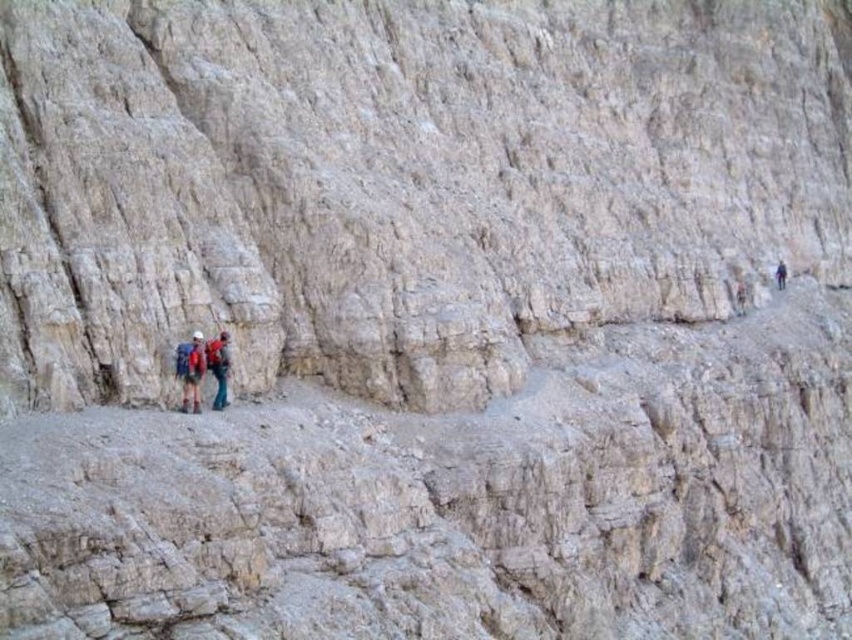
You are a hiker planning to move from the red fabric backpack at center to the dark blue fabric backpack at right. Given that the path between them is 56.47 meters, can you safely traverse this distance if your maximum safe distance for a single traverse is 50 meters?

The distance between the red fabric backpack at center and the dark blue fabric backpack at right is 56.47 meters, which exceeds your maximum safe distance of 50 meters. Therefore, it is not safe to traverse this distance in one go.

You are a hiker planning to take a photo of both the matte red backpacks at center and the dark blue fabric backpack at right. Since you want both backpacks to be clearly visible in the frame, which backpack should you focus on first?

You should focus on the matte red backpacks at center first because it is in front of the dark blue fabric backpack at right, so it will be the primary focus in the photo.